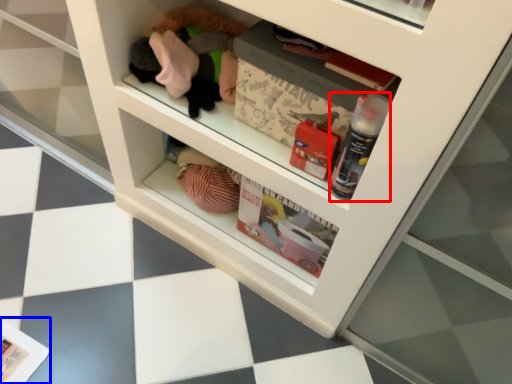
Question: Which of the following is the closest to the observer, bottle (highlighted by a red box) or magazine (highlighted by a blue box)?

Choices:
 (A) bottle
 (B) magazine

Answer: (A)